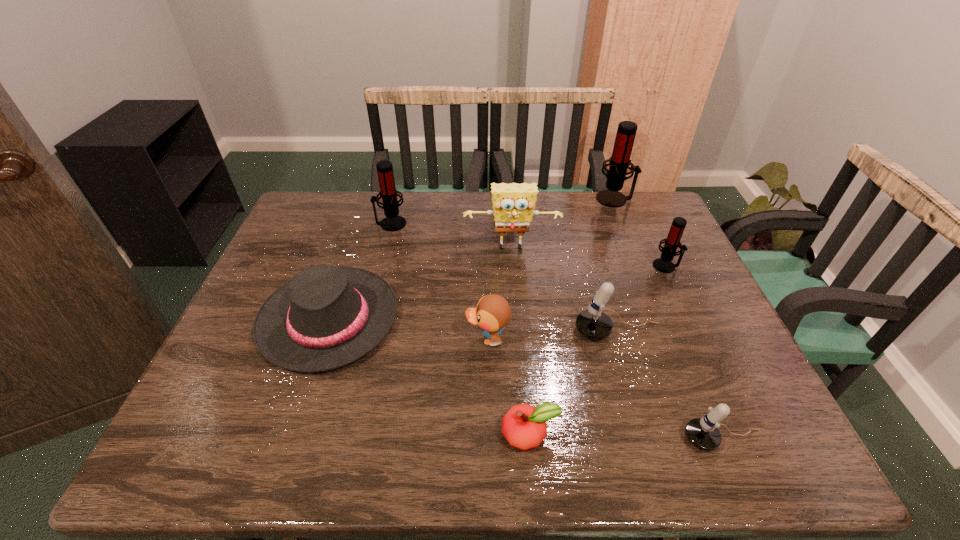
Find the location of a particular element. object at the far right corner is located at coordinates (619, 162).

Locate an element on the screen. Image resolution: width=960 pixels, height=540 pixels. object that is at the near right corner is located at coordinates (703, 433).

Image resolution: width=960 pixels, height=540 pixels. I want to click on vacant space at the far edge of the desktop, so coord(414,228).

Identify the location of vacant area at the near edge. The height and width of the screenshot is (540, 960). (267, 431).

Find the location of `free space at the left edge of the desktop`. free space at the left edge of the desktop is located at coordinates (290, 234).

This screenshot has width=960, height=540. What are the coordinates of `free region at the far left corner of the desktop` in the screenshot? It's located at (338, 204).

The width and height of the screenshot is (960, 540). Identify the location of vacant region at the near left corner. (228, 434).

In the image, there is a desktop. Where is `vacant area at the far right corner`? vacant area at the far right corner is located at coordinates [x=641, y=198].

What are the coordinates of `blank area at the near right corner` in the screenshot? It's located at (726, 437).

Locate an element on the screen. This screenshot has width=960, height=540. blank region between the blue duck and the second nearest red microphone is located at coordinates (440, 281).